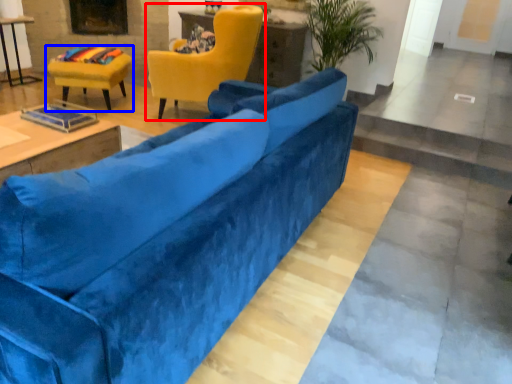
Question: Which object appears closest to the camera in this image, chair (highlighted by a red box) or chair (highlighted by a blue box)?

Choices:
 (A) chair
 (B) chair

Answer: (A)